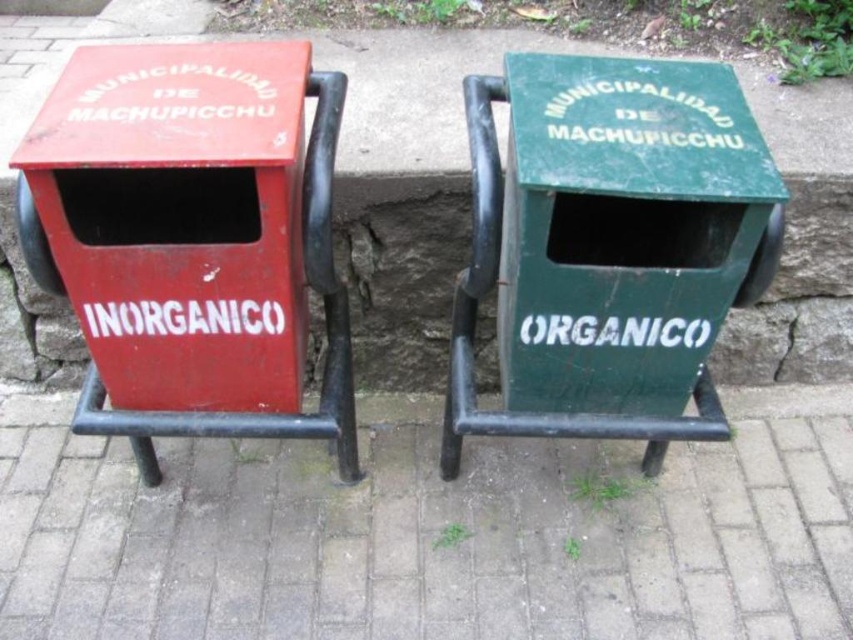
Based on the photo, which of these two, green matte trash bin at center or metallic trash bin at center, stands taller?

With more height is metallic trash bin at center.

Who is more distant from viewer, (636, 301) or (827, 115)?

Point (827, 115)

Locate an element on the screen. green matte trash bin at center is located at coordinates (608, 248).

Consider the image. Who is positioned more to the right, gray concrete pavement at center or matte red bin at left?

Positioned to the right is gray concrete pavement at center.

Does point (831, 541) lie in front of point (260, 257)?

No.

Which is behind, point (123, 451) or point (202, 273)?

Positioned behind is point (123, 451).

This screenshot has height=640, width=853. What are the coordinates of `gray concrete pavement at center` in the screenshot? It's located at (430, 532).

Does matte red bin at left have a greater width compared to green matte trash bin at center?

Incorrect, matte red bin at left's width does not surpass green matte trash bin at center's.

Describe the element at coordinates (194, 237) in the screenshot. I see `matte red bin at left` at that location.

Does point (223, 216) come behind point (701, 372)?

Yes, point (223, 216) is behind point (701, 372).

The width and height of the screenshot is (853, 640). I want to click on matte red bin at left, so click(x=194, y=237).